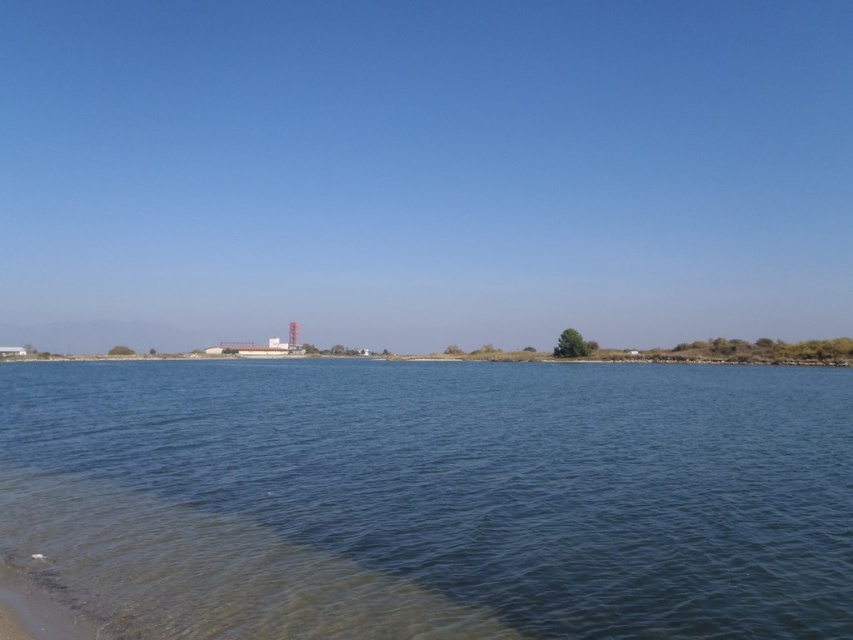
Question: Which point is farther to the camera?

Choices:
 (A) blue water at center
 (B) sandy beach at lower left

Answer: (A)

Question: Which of the following is the farthest from the observer?

Choices:
 (A) blue water at center
 (B) sandy beach at lower left

Answer: (A)

Question: Among these objects, which one is nearest to the camera?

Choices:
 (A) blue water at center
 (B) sandy beach at lower left

Answer: (B)

Question: Does blue water at center appear over sandy beach at lower left?

Choices:
 (A) yes
 (B) no

Answer: (B)

Question: Observing the image, what is the correct spatial positioning of blue water at center in reference to sandy beach at lower left?

Choices:
 (A) left
 (B) right

Answer: (B)

Question: Is blue water at center closer to the viewer compared to sandy beach at lower left?

Choices:
 (A) yes
 (B) no

Answer: (B)